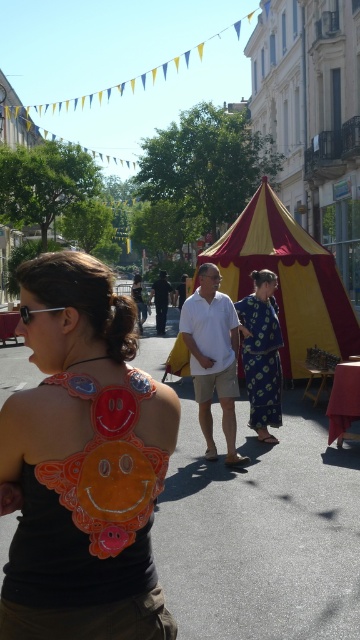
You are a photographer at the festival and want to capture both the orange fabric smiley face at upper left and the white cotton shirt at center in your photo. Which object should you focus on first to ensure both are in frame?

The orange fabric smiley face at upper left is not as tall as the white cotton shirt at center, so you should focus on the taller white cotton shirt at center first to ensure both fit in the frame.